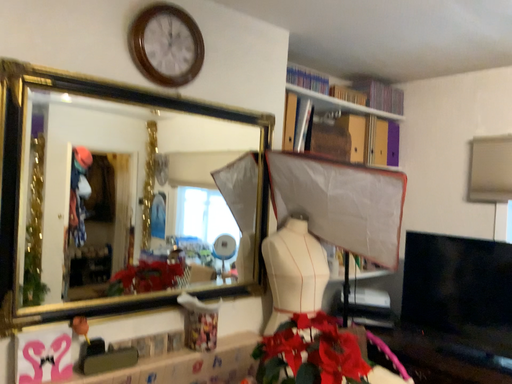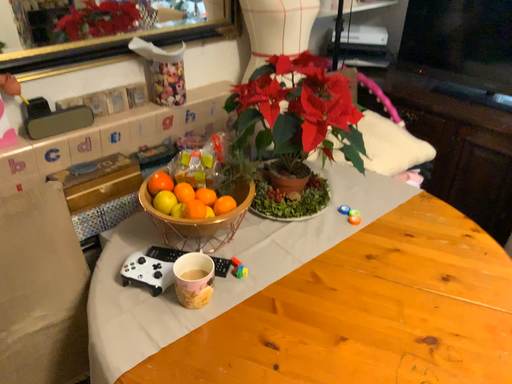
Question: How did the camera likely rotate when shooting the video?

Choices:
 (A) rotated upward
 (B) rotated downward

Answer: (B)